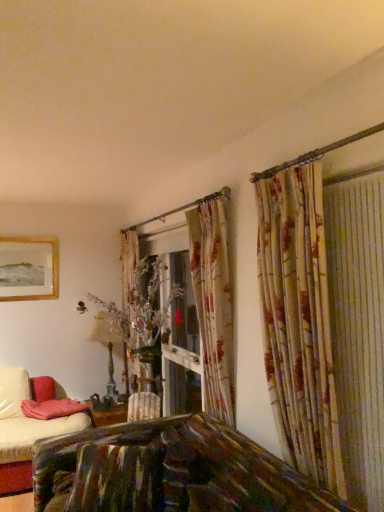
Describe the element at coordinates (107, 347) in the screenshot. I see `antique brass table lamp at center` at that location.

The width and height of the screenshot is (384, 512). Describe the element at coordinates (53, 408) in the screenshot. I see `pink fabric pillow at lower left` at that location.

Where is `wooden framed picture at upper left`? wooden framed picture at upper left is located at coordinates (29, 268).

Considering the relative positions of antique brass table lamp at center and pink fabric pillow at lower left in the image provided, is antique brass table lamp at center to the left or to the right of pink fabric pillow at lower left?

antique brass table lamp at center is to the right of pink fabric pillow at lower left.

Does antique brass table lamp at center have a lesser width compared to pink fabric pillow at lower left?

Yes, antique brass table lamp at center is thinner than pink fabric pillow at lower left.

Is antique brass table lamp at center facing away from pink fabric pillow at lower left?

antique brass table lamp at center does not have its back to pink fabric pillow at lower left.

Considering the relative positions of wooden framed picture at upper left and pink fabric pillow at lower left in the image provided, is wooden framed picture at upper left to the right of pink fabric pillow at lower left from the viewer's perspective?

Incorrect, wooden framed picture at upper left is not on the right side of pink fabric pillow at lower left.

How different are the orientations of wooden framed picture at upper left and pink fabric pillow at lower left in degrees?

The facing directions of wooden framed picture at upper left and pink fabric pillow at lower left are 29.1 degrees apart.

Where is `pillow on the right of wooden framed picture at upper left`? The width and height of the screenshot is (384, 512). pillow on the right of wooden framed picture at upper left is located at coordinates (53, 408).

Considering the relative sizes of wooden framed picture at upper left and pink fabric pillow at lower left in the image provided, is wooden framed picture at upper left shorter than pink fabric pillow at lower left?

Incorrect, the height of wooden framed picture at upper left does not fall short of that of pink fabric pillow at lower left.

Locate an element on the screen. This screenshot has height=512, width=384. table lamp below the wooden framed picture at upper left (from a real-world perspective) is located at coordinates (107, 347).

What's the angular difference between wooden framed picture at upper left and antique brass table lamp at center's facing directions?

The facing directions of wooden framed picture at upper left and antique brass table lamp at center are 17.3 degrees apart.

From the image's perspective, is wooden framed picture at upper left positioned above or below antique brass table lamp at center?

Clearly, from the image's perspective, wooden framed picture at upper left is above antique brass table lamp at center.

Which is more to the right, wooden framed picture at upper left or antique brass table lamp at center?

antique brass table lamp at center is more to the right.

Identify the location of pillow located below the wooden framed picture at upper left (from the image's perspective). The width and height of the screenshot is (384, 512). (53, 408).

Is pink fabric pillow at lower left positioned before wooden framed picture at upper left?

Yes, pink fabric pillow at lower left is closer to the camera.

Is pink fabric pillow at lower left facing towards wooden framed picture at upper left?

No, pink fabric pillow at lower left does not turn towards wooden framed picture at upper left.

Is pink fabric pillow at lower left wider than wooden framed picture at upper left?

Yes, pink fabric pillow at lower left is wider than wooden framed picture at upper left.

Consider the image. Is pink fabric pillow at lower left in contact with antique brass table lamp at center?

pink fabric pillow at lower left and antique brass table lamp at center are clearly separated.

Is pink fabric pillow at lower left inside or outside of antique brass table lamp at center?

pink fabric pillow at lower left is spatially situated outside antique brass table lamp at center.

Is point (65, 400) closer to viewer compared to point (98, 330)?

Yes, point (65, 400) is closer to viewer.

Is antique brass table lamp at center taller or shorter than wooden framed picture at upper left?

Considering their sizes, antique brass table lamp at center has more height than wooden framed picture at upper left.

Is antique brass table lamp at center oriented towards wooden framed picture at upper left?

No, antique brass table lamp at center is not turned towards wooden framed picture at upper left.

Considering the relative sizes of antique brass table lamp at center and wooden framed picture at upper left in the image provided, is antique brass table lamp at center smaller than wooden framed picture at upper left?

Incorrect, antique brass table lamp at center is not smaller in size than wooden framed picture at upper left.

In the scene shown: Can you tell me how much antique brass table lamp at center and wooden framed picture at upper left differ in facing direction?

They differ by 17.3 degrees in their facing directions.

Image resolution: width=384 pixels, height=512 pixels. Find the location of `table lamp on the right of pink fabric pillow at lower left`. table lamp on the right of pink fabric pillow at lower left is located at coordinates (107, 347).

Where is `picture frame behind the pink fabric pillow at lower left`? The height and width of the screenshot is (512, 384). picture frame behind the pink fabric pillow at lower left is located at coordinates (29, 268).

Based on their spatial positions, is pink fabric pillow at lower left or wooden framed picture at upper left closer to antique brass table lamp at center?

pink fabric pillow at lower left is closer to antique brass table lamp at center.

Looking at this image, when comparing their distances from pink fabric pillow at lower left, does wooden framed picture at upper left or antique brass table lamp at center seem closer?

Among the two, antique brass table lamp at center is located nearer to pink fabric pillow at lower left.

Looking at this image, looking at the image, which one is located further to antique brass table lamp at center, wooden framed picture at upper left or pink fabric pillow at lower left?

Based on the image, wooden framed picture at upper left appears to be further to antique brass table lamp at center.

Looking at this image, considering their positions, is antique brass table lamp at center positioned closer to pink fabric pillow at lower left than wooden framed picture at upper left?

The object closer to pink fabric pillow at lower left is antique brass table lamp at center.

From the image, which object appears to be nearer to wooden framed picture at upper left, pink fabric pillow at lower left or antique brass table lamp at center?

Based on the image, antique brass table lamp at center appears to be nearer to wooden framed picture at upper left.

From the image, which object appears to be farther from wooden framed picture at upper left, antique brass table lamp at center or pink fabric pillow at lower left?

pink fabric pillow at lower left is further to wooden framed picture at upper left.

The width and height of the screenshot is (384, 512). Identify the location of table lamp between wooden framed picture at upper left and pink fabric pillow at lower left from top to bottom. (107, 347).